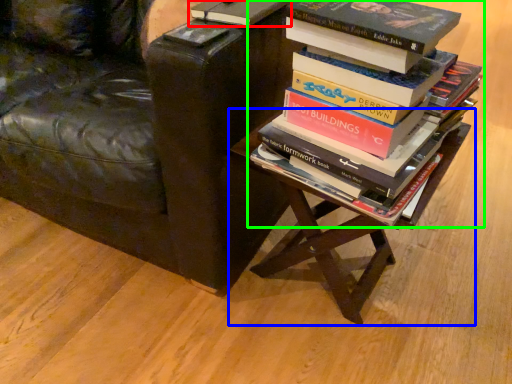
Question: Considering the real-world distances, which object is closest to book (highlighted by a red box)? table (highlighted by a blue box) or book (highlighted by a green box).

Choices:
 (A) table
 (B) book

Answer: (B)